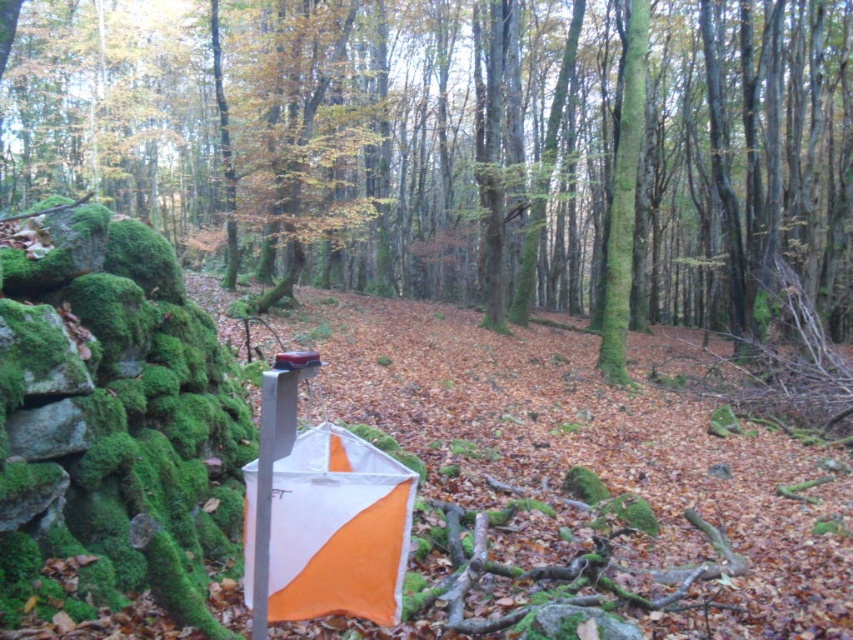
You are a hiker who has just found shelter under the orange fabric umbrella at center and the green mossy tree at center. Which object is closer to the ground?

The orange fabric umbrella at center is closer to the ground since it is positioned below the green mossy tree at center.

You are a hiker who has just found an orange fabric umbrella at center and a green mossy tree at center in the forest. Which object is located to the left when facing the scene?

The orange fabric umbrella at center is positioned on the left side of the green mossy tree at center, so it is located to the left when facing the scene.